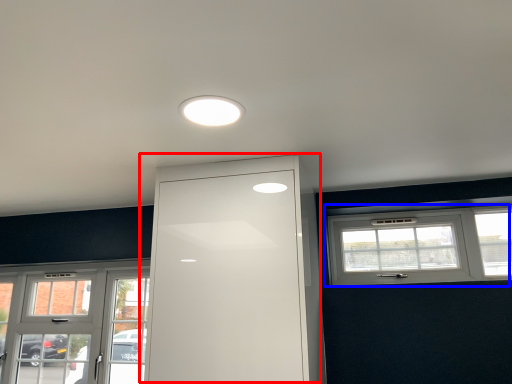
Question: Which object is closer to the camera taking this photo, door (highlighted by a red box) or window (highlighted by a blue box)?

Choices:
 (A) door
 (B) window

Answer: (A)